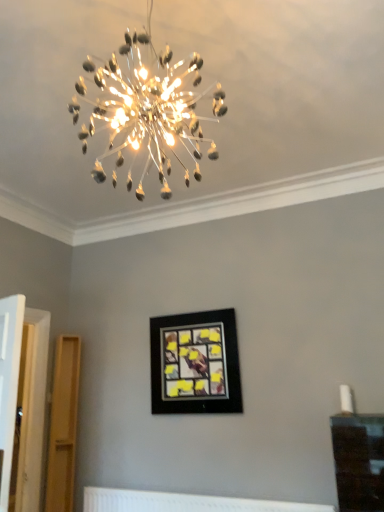
Describe the element at coordinates (184, 502) in the screenshot. I see `white textured radiator at lower center` at that location.

Identify the location of black matte picture frame at center. (195, 362).

This screenshot has width=384, height=512. Identify the location of white textured radiator at lower center. point(184,502).

Is black matte picture frame at center placed right next to clear glass chandelier at upper center?

No, black matte picture frame at center is not with clear glass chandelier at upper center.

You are a GUI agent. You are given a task and a screenshot of the screen. Output one action in this format:
    pyautogui.click(x=<x>, y=<y>)
    Task: Click on the picture frame below the clear glass chandelier at upper center (from the image's perspective)
    
    Given the screenshot: What is the action you would take?
    pyautogui.click(x=195, y=362)

Can you tell me how much black matte picture frame at center and clear glass chandelier at upper center differ in facing direction?

90.3 degrees separate the facing orientations of black matte picture frame at center and clear glass chandelier at upper center.

Can you tell me how much white textured radiator at lower center and clear glass chandelier at upper center differ in facing direction?

white textured radiator at lower center and clear glass chandelier at upper center are facing 91.5 degrees away from each other.

Are white textured radiator at lower center and clear glass chandelier at upper center making contact?

No, white textured radiator at lower center is not with clear glass chandelier at upper center.

Is point (236, 509) closer to camera compared to point (162, 52)?

That is False.

From the image's perspective, is white textured radiator at lower center positioned above or below clear glass chandelier at upper center?

white textured radiator at lower center is below clear glass chandelier at upper center.

Can you confirm if white textured radiator at lower center is bigger than black matte picture frame at center?

No, white textured radiator at lower center is not bigger than black matte picture frame at center.

From the image's perspective, is white textured radiator at lower center above or below black matte picture frame at center?

white textured radiator at lower center is below black matte picture frame at center.

How different are the orientations of white textured radiator at lower center and black matte picture frame at center in degrees?

white textured radiator at lower center and black matte picture frame at center are facing 1.13 degrees away from each other.

From a real-world perspective, between white textured radiator at lower center and black matte picture frame at center, who is vertically higher?

black matte picture frame at center.

Which is further, (x=113, y=178) or (x=181, y=347)?

Positioned behind is point (x=181, y=347).

Who is smaller, clear glass chandelier at upper center or black matte picture frame at center?

black matte picture frame at center is smaller.

Which object is more forward, clear glass chandelier at upper center or black matte picture frame at center?

clear glass chandelier at upper center is in front.

Choose the correct answer: Is clear glass chandelier at upper center inside black matte picture frame at center or outside it?

clear glass chandelier at upper center is spatially situated outside black matte picture frame at center.

From a real-world perspective, is black matte picture frame at center physically located above or below white textured radiator at lower center?

From a real-world perspective, black matte picture frame at center is physically above white textured radiator at lower center.

Who is more distant, black matte picture frame at center or white textured radiator at lower center?

black matte picture frame at center.

How many degrees apart are the facing directions of black matte picture frame at center and white textured radiator at lower center?

The facing directions of black matte picture frame at center and white textured radiator at lower center are 1.13 degrees apart.

Is black matte picture frame at center bigger than white textured radiator at lower center?

Yes, black matte picture frame at center is bigger than white textured radiator at lower center.

From the image's perspective, between clear glass chandelier at upper center and white textured radiator at lower center, which one is located above?

From the image's view, clear glass chandelier at upper center is above.

In the scene shown: Is the depth of clear glass chandelier at upper center greater than that of white textured radiator at lower center?

No.

Does point (111, 79) come behind point (143, 493)?

No, (111, 79) is closer to viewer.

This screenshot has height=512, width=384. I want to click on lamp positioned vertically above the black matte picture frame at center (from a real-world perspective), so click(x=149, y=110).

You are a GUI agent. You are given a task and a screenshot of the screen. Output one action in this format:
    pyautogui.click(x=<x>, y=<y>)
    Task: Click on the radiator that is under the clear glass chandelier at upper center (from a real-world perspective)
    Image resolution: width=384 pixels, height=512 pixels.
    Given the screenshot: What is the action you would take?
    pyautogui.click(x=184, y=502)

Estimate the real-world distances between objects in this image. Which object is further from clear glass chandelier at upper center, white textured radiator at lower center or black matte picture frame at center?

white textured radiator at lower center lies further to clear glass chandelier at upper center than the other object.

Which object lies nearer to the anchor point black matte picture frame at center, white textured radiator at lower center or clear glass chandelier at upper center?

Based on the image, white textured radiator at lower center appears to be nearer to black matte picture frame at center.

Based on their spatial positions, is black matte picture frame at center or white textured radiator at lower center further from clear glass chandelier at upper center?

The object further to clear glass chandelier at upper center is white textured radiator at lower center.

From the image, which object appears to be farther from white textured radiator at lower center, clear glass chandelier at upper center or black matte picture frame at center?

Based on the image, clear glass chandelier at upper center appears to be further to white textured radiator at lower center.

Estimate the real-world distances between objects in this image. Which object is further from white textured radiator at lower center, black matte picture frame at center or clear glass chandelier at upper center?

clear glass chandelier at upper center is positioned further to the anchor white textured radiator at lower center.

Considering their positions, is clear glass chandelier at upper center positioned closer to black matte picture frame at center than white textured radiator at lower center?

white textured radiator at lower center.

Where is `picture frame between clear glass chandelier at upper center and white textured radiator at lower center in the vertical direction`? picture frame between clear glass chandelier at upper center and white textured radiator at lower center in the vertical direction is located at coordinates (195, 362).